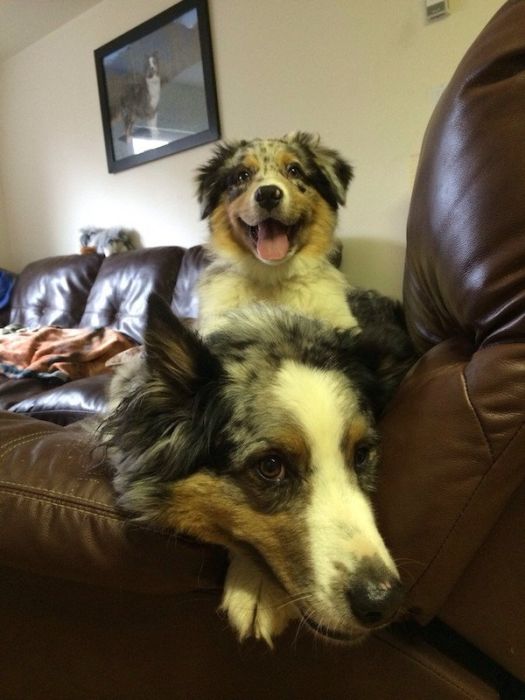
Locate an element on the screen. The image size is (525, 700). wall is located at coordinates (349, 66).